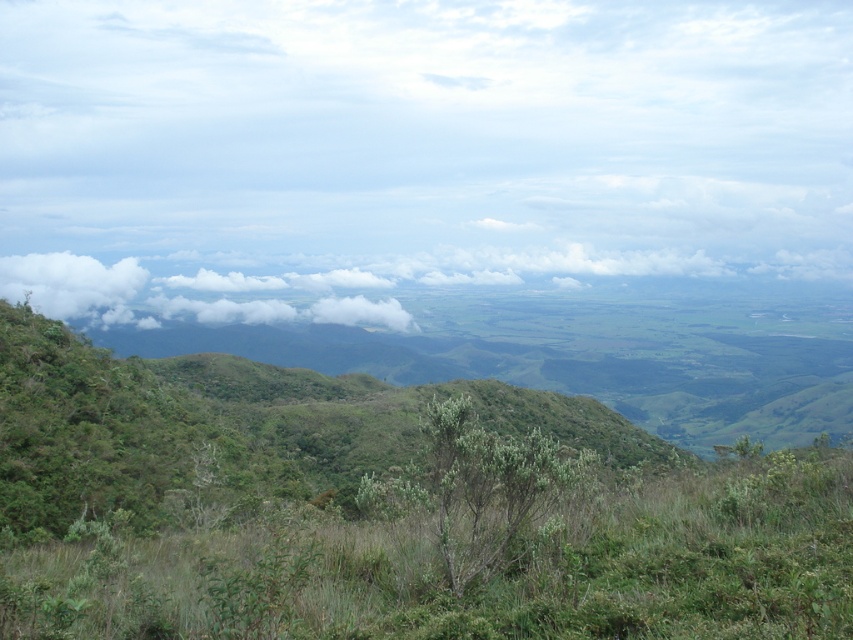
Image resolution: width=853 pixels, height=640 pixels. Describe the element at coordinates (380, 512) in the screenshot. I see `green leafy shrubs at center` at that location.

Which is in front, point (666, 596) or point (469, 413)?

Point (666, 596) is in front.

Does point (479, 584) come closer to viewer compared to point (469, 540)?

Yes, it is in front of point (469, 540).

In order to click on green leafy shrubs at center in this screenshot , I will do `click(380, 512)`.

Is point (212, 404) farther from viewer compared to point (99, 289)?

No, (212, 404) is in front of (99, 289).

At what (x,y) coordinates should I click in order to perform the action: click on green leafy shrubs at center. Please return your answer as a coordinate pair (x, y). Looking at the image, I should click on (380, 512).

Where is `green leafy shrubs at center`? This screenshot has width=853, height=640. green leafy shrubs at center is located at coordinates (380, 512).

This screenshot has height=640, width=853. Identify the location of green leafy shrubs at center. point(380,512).

Between white fluffy cloud at upper center and green leafy shrubs at center, which one has less height?

Standing shorter between the two is green leafy shrubs at center.

Which is above, white fluffy cloud at upper center or green leafy shrubs at center?

Positioned higher is white fluffy cloud at upper center.

Is point (608, 202) behind point (345, 600)?

Yes, point (608, 202) is farther from viewer.

Locate an element on the screen. This screenshot has width=853, height=640. white fluffy cloud at upper center is located at coordinates (424, 145).